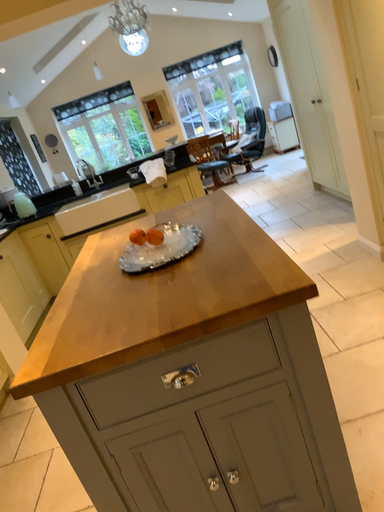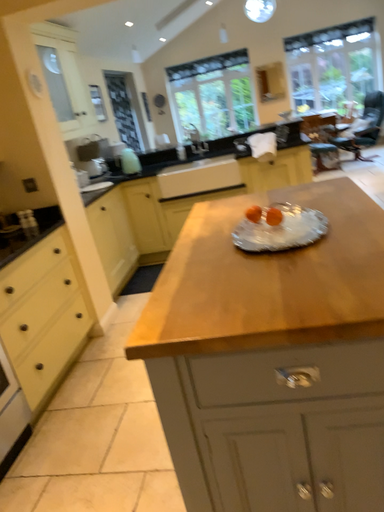
Question: How did the camera likely rotate when shooting the video?

Choices:
 (A) rotated right
 (B) rotated left

Answer: (B)